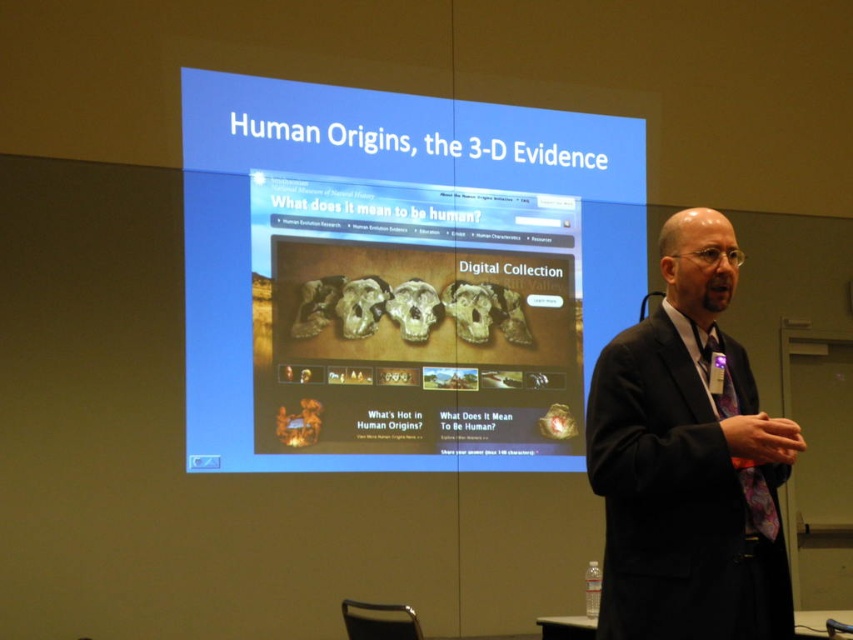
In the scene shown: Between black suit at center and purple floral tie at right, which one is positioned higher?

black suit at center

Is the position of black suit at center less distant than that of purple floral tie at right?

Yes, it is.

The height and width of the screenshot is (640, 853). What do you see at coordinates (688, 460) in the screenshot? I see `black suit at center` at bounding box center [688, 460].

Locate an element on the screen. black suit at center is located at coordinates (688, 460).

Between matte digital display at center and black suit at center, which one is positioned lower?

black suit at center

Does matte digital display at center lie in front of black suit at center?

No, matte digital display at center is behind black suit at center.

The width and height of the screenshot is (853, 640). I want to click on matte digital display at center, so click(398, 275).

Where is `matte digital display at center`? The image size is (853, 640). matte digital display at center is located at coordinates (398, 275).

Who is higher up, matte digital display at center or purple floral tie at right?

Positioned higher is matte digital display at center.

Who is more forward, (509, 113) or (711, 380)?

Point (711, 380) is more forward.

Locate an element on the screen. matte digital display at center is located at coordinates (398, 275).

At what (x,y) coordinates should I click in order to perform the action: click on matte digital display at center. Please return your answer as a coordinate pair (x, y). This screenshot has height=640, width=853. Looking at the image, I should click on (398, 275).